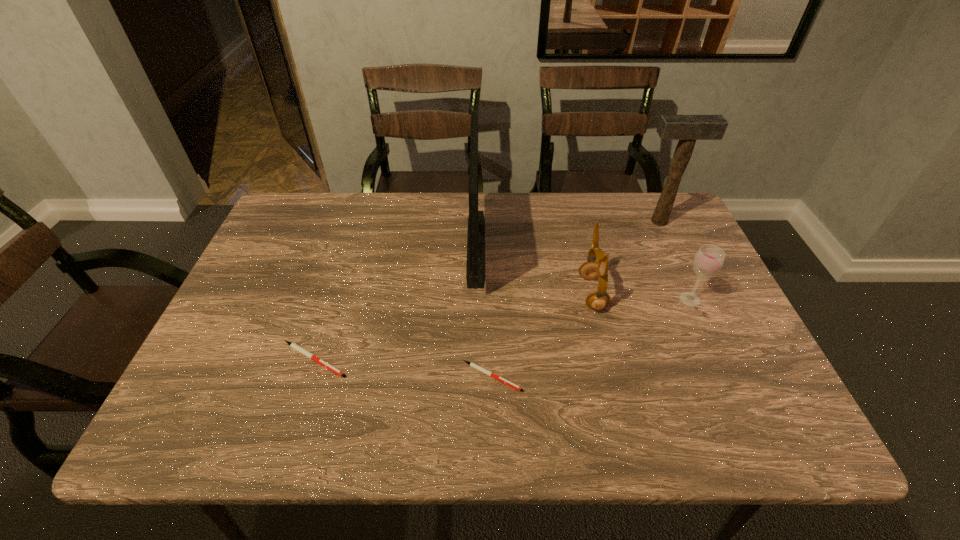
With all pens evenly spaced, where should an extra pen be placed on the right to continue the pattern? Please point out a vacant space. Please provide its 2D coordinates. Your answer should be formatted as a tuple, i.e. [(x, y)], where the tuple contains the x and y coordinates of a point satisfying the conditions above.

[(682, 395)]